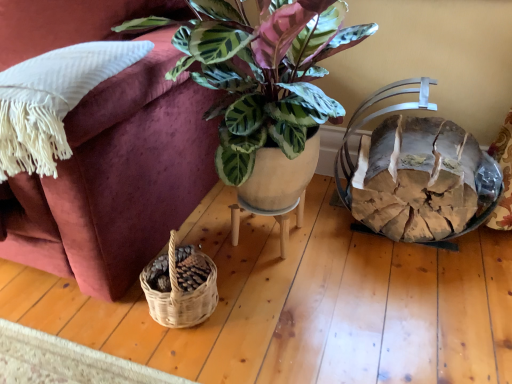
Question: Considering the relative positions of matte ceramic plant at center and white fringed pillow at left in the image provided, is matte ceramic plant at center to the right of white fringed pillow at left from the viewer's perspective?

Choices:
 (A) yes
 (B) no

Answer: (A)

Question: Is matte ceramic plant at center located outside white fringed pillow at left?

Choices:
 (A) yes
 (B) no

Answer: (A)

Question: Is matte ceramic plant at center oriented away from white fringed pillow at left?

Choices:
 (A) no
 (B) yes

Answer: (A)

Question: From a real-world perspective, is matte ceramic plant at center below white fringed pillow at left?

Choices:
 (A) yes
 (B) no

Answer: (A)

Question: Is matte ceramic plant at center taller than white fringed pillow at left?

Choices:
 (A) yes
 (B) no

Answer: (A)

Question: Is matte ceramic plant at center situated inside white fringed pillow at left or outside?

Choices:
 (A) inside
 (B) outside

Answer: (B)

Question: Considering the positions of matte ceramic plant at center and white fringed pillow at left in the image, is matte ceramic plant at center taller or shorter than white fringed pillow at left?

Choices:
 (A) tall
 (B) short

Answer: (A)

Question: Is matte ceramic plant at center wider or thinner than white fringed pillow at left?

Choices:
 (A) thin
 (B) wide

Answer: (B)

Question: Is point (129, 29) closer or farther from the camera than point (56, 135)?

Choices:
 (A) closer
 (B) farther

Answer: (B)

Question: Visually, is rustic wood log basket at right positioned to the left or to the right of white fringed pillow at left?

Choices:
 (A) right
 (B) left

Answer: (A)

Question: Looking at the image, does rustic wood log basket at right seem bigger or smaller compared to white fringed pillow at left?

Choices:
 (A) small
 (B) big

Answer: (A)

Question: In terms of height, does rustic wood log basket at right look taller or shorter compared to white fringed pillow at left?

Choices:
 (A) tall
 (B) short

Answer: (A)

Question: Is rustic wood log basket at right wider or thinner than white fringed pillow at left?

Choices:
 (A) thin
 (B) wide

Answer: (A)

Question: From the image's perspective, relative to rustic wood log basket at right, is matte ceramic pot at center above or below?

Choices:
 (A) above
 (B) below

Answer: (B)

Question: Is matte ceramic pot at center taller or shorter than rustic wood log basket at right?

Choices:
 (A) tall
 (B) short

Answer: (B)